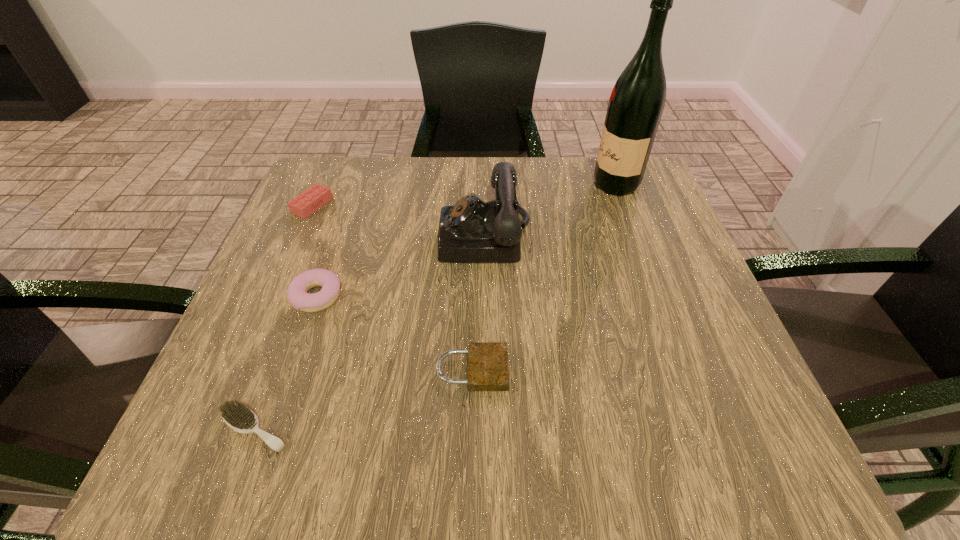
Identify the location of vacant area at the right edge of the desktop. (711, 360).

Find the location of `free spot at the far left corner of the desktop`. free spot at the far left corner of the desktop is located at coordinates (323, 185).

The image size is (960, 540). Find the location of `vacant space at the far right corner of the desktop`. vacant space at the far right corner of the desktop is located at coordinates (600, 196).

Where is `free region at the near right corner of the desktop`? The image size is (960, 540). free region at the near right corner of the desktop is located at coordinates (665, 456).

Where is `free spot between the scrubbing brush and the telephone`? free spot between the scrubbing brush and the telephone is located at coordinates (370, 333).

You are a GUI agent. You are given a task and a screenshot of the screen. Output one action in this format:
    pyautogui.click(x=<x>, y=<y>)
    Task: Click on the free point between the doughnut and the second tallest object
    The image size is (960, 540).
    Given the screenshot: What is the action you would take?
    pyautogui.click(x=401, y=267)

At what (x,y) coordinates should I click in order to perform the action: click on vacant region between the padlock and the rightmost object. Please return your answer as a coordinate pair (x, y). Looking at the image, I should click on (543, 278).

You are a GUI agent. You are given a task and a screenshot of the screen. Output one action in this format:
    pyautogui.click(x=<x>, y=<y>)
    Task: Click on the empty space that is in between the padlock and the Lego
    Image resolution: width=960 pixels, height=540 pixels.
    Given the screenshot: What is the action you would take?
    pyautogui.click(x=392, y=288)

I want to click on free spot between the telephone and the rightmost object, so click(x=551, y=211).

Find the location of a particular element. Image resolution: width=960 pixels, height=540 pixels. empty location between the Lego and the second tallest object is located at coordinates (399, 222).